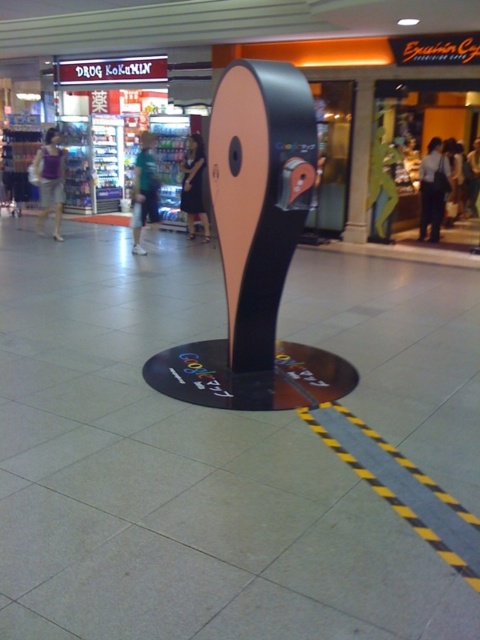
Is point (372, 116) positioned before point (437, 147)?

That is True.

Can you confirm if matte black display stand at center is positioned to the right of matte black shirt at center?

In fact, matte black display stand at center is to the left of matte black shirt at center.

Locate an element on the screen. The height and width of the screenshot is (640, 480). matte black display stand at center is located at coordinates (307, 76).

Is point (288, 16) farther from camera compared to point (50, 163)?

No, (288, 16) is in front of (50, 163).

Measure the distance between matte black display stand at center and matte purple tank top at left.

matte black display stand at center and matte purple tank top at left are 14.38 feet apart.

Does point (145, 19) lie in front of point (44, 168)?

No, (145, 19) is behind (44, 168).

Locate an element on the screen. matte black display stand at center is located at coordinates (307, 76).

Is point (430, 220) behind point (189, 170)?

Yes, point (430, 220) is farther from viewer.

At what (x,y) coordinates should I click in order to perform the action: click on matte black shirt at center. Please return your answer as a coordinate pair (x, y). This screenshot has height=640, width=480. Looking at the image, I should click on (432, 188).

Locate an element on the screen. The height and width of the screenshot is (640, 480). matte black shirt at center is located at coordinates (432, 188).